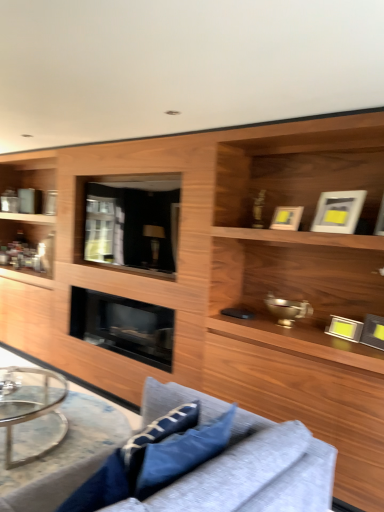
Question: Is clear glass coffee table at lower left located within transparent glass door at center?

Choices:
 (A) yes
 (B) no

Answer: (B)

Question: Is transparent glass door at center positioned behind clear glass coffee table at lower left?

Choices:
 (A) no
 (B) yes

Answer: (B)

Question: From a real-world perspective, is transparent glass door at center physically below clear glass coffee table at lower left?

Choices:
 (A) yes
 (B) no

Answer: (B)

Question: From the image's perspective, does transparent glass door at center appear lower than clear glass coffee table at lower left?

Choices:
 (A) yes
 (B) no

Answer: (B)

Question: Is transparent glass door at center at the left side of clear glass coffee table at lower left?

Choices:
 (A) no
 (B) yes

Answer: (A)

Question: From a real-world perspective, is transparent glass door at center over clear glass coffee table at lower left?

Choices:
 (A) no
 (B) yes

Answer: (B)

Question: Is clear glass coffee table at lower left smaller than blue fabric pillow at lower center, which is counted as the 1th pillow, starting from the front?

Choices:
 (A) yes
 (B) no

Answer: (B)

Question: Is clear glass coffee table at lower left taller than blue fabric pillow at lower center, positioned as the second pillow in right-to-left order?

Choices:
 (A) yes
 (B) no

Answer: (B)

Question: Considering the relative positions of clear glass coffee table at lower left and blue fabric pillow at lower center, which is the second pillow in back-to-front order, in the image provided, is clear glass coffee table at lower left to the right of blue fabric pillow at lower center, which is the second pillow in back-to-front order, from the viewer's perspective?

Choices:
 (A) yes
 (B) no

Answer: (B)

Question: From a real-world perspective, is clear glass coffee table at lower left below blue fabric pillow at lower center, which is the second pillow in back-to-front order?

Choices:
 (A) no
 (B) yes

Answer: (B)

Question: From a real-world perspective, is clear glass coffee table at lower left on top of blue fabric pillow at lower center, which is the second pillow in back-to-front order?

Choices:
 (A) no
 (B) yes

Answer: (A)

Question: Does clear glass coffee table at lower left have a lesser width compared to blue fabric pillow at lower center, positioned as the second pillow in right-to-left order?

Choices:
 (A) no
 (B) yes

Answer: (A)

Question: Considering the relative positions of black glass fireplace at center and blue fabric pillow at lower center, which ranks as the first pillow in back-to-front order, in the image provided, is black glass fireplace at center in front of blue fabric pillow at lower center, which ranks as the first pillow in back-to-front order,?

Choices:
 (A) no
 (B) yes

Answer: (A)